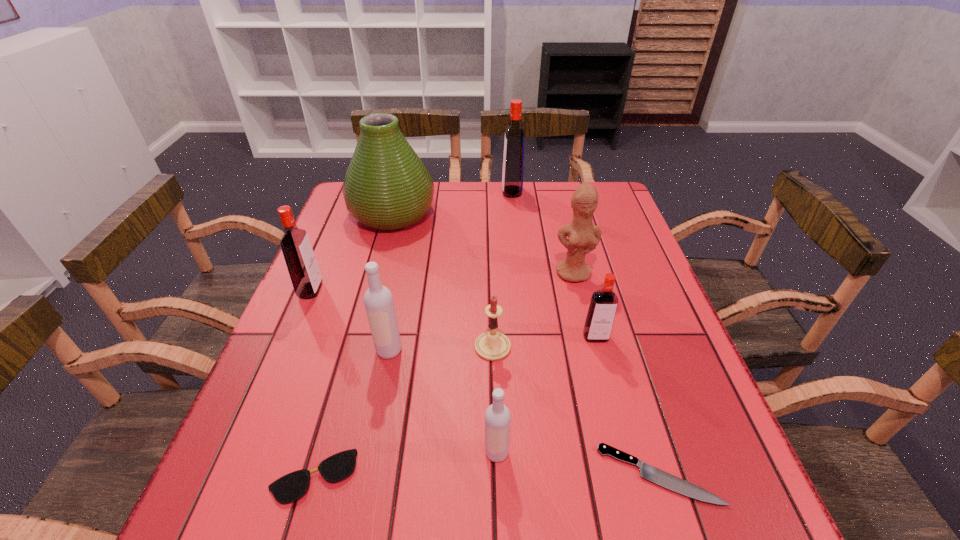
Locate an element on the screen. the nearest vodka is located at coordinates (497, 416).

Locate an element on the screen. The height and width of the screenshot is (540, 960). the smaller white vodka is located at coordinates (497, 416).

Where is `the third shortest object`? The image size is (960, 540). the third shortest object is located at coordinates (492, 345).

Identify the location of red candle. (492, 345).

The height and width of the screenshot is (540, 960). I want to click on spectacles, so click(x=290, y=487).

At what (x,y) coordinates should I click in order to perform the action: click on steak knife. Please return your answer as a coordinate pair (x, y). Image resolution: width=960 pixels, height=540 pixels. Looking at the image, I should click on (648, 472).

Locate an element on the screen. The height and width of the screenshot is (540, 960). free region located 0.170m on the front and back of the second red vodka from left to right is located at coordinates (451, 192).

This screenshot has height=540, width=960. What are the coordinates of `vacant space located on the front and back of the second red vodka from left to right` in the screenshot? It's located at (457, 192).

This screenshot has width=960, height=540. In order to click on free space located on the front and back of the second red vodka from left to right in this screenshot , I will do `click(457, 192)`.

Identify the location of vacant point located on the right of the green vase. (480, 214).